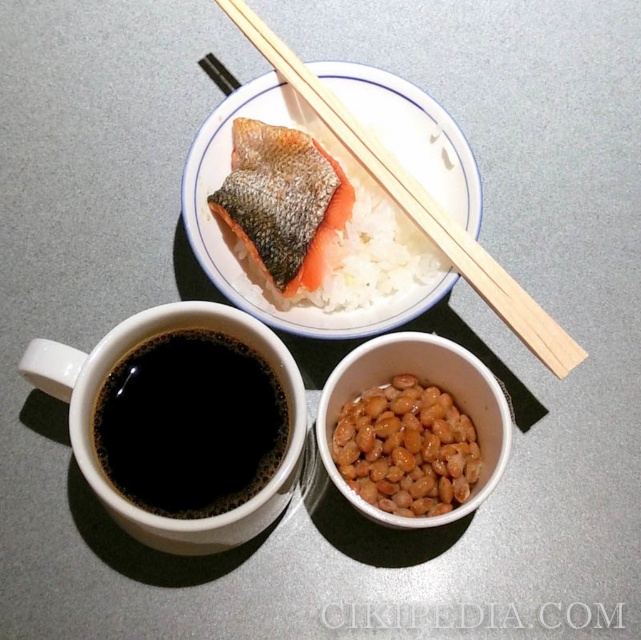
Is point (413, 408) farther from camera compared to point (517, 285)?

Yes, it is behind point (517, 285).

Between brown matte beans at center and wooden chopsticks at upper center, which one appears on the right side from the viewer's perspective?

From the viewer's perspective, brown matte beans at center appears more on the right side.

The height and width of the screenshot is (640, 641). Describe the element at coordinates (406, 449) in the screenshot. I see `brown matte beans at center` at that location.

At what (x,y) coordinates should I click in order to perform the action: click on brown matte beans at center. Please return your answer as a coordinate pair (x, y). The image size is (641, 640). Looking at the image, I should click on (406, 449).

Can you confirm if black matte cup at lower left is bigger than brown matte beans at center?

Actually, black matte cup at lower left might be smaller than brown matte beans at center.

Who is more distant from viewer, (196, 481) or (353, 490)?

Point (353, 490)

Locate an element on the screen. The height and width of the screenshot is (640, 641). black matte cup at lower left is located at coordinates (190, 424).

Is black matte cup at lower left behind pinkish-orange flesh at upper center?

No, black matte cup at lower left is closer to the viewer.

Is black matte cup at lower left to the right of pinkish-orange flesh at upper center from the viewer's perspective?

Incorrect, black matte cup at lower left is not on the right side of pinkish-orange flesh at upper center.

Which is behind, point (235, 460) or point (319, 148)?

The point (319, 148) is more distant.

Find the location of `black matte cup at lower left`. black matte cup at lower left is located at coordinates (190, 424).